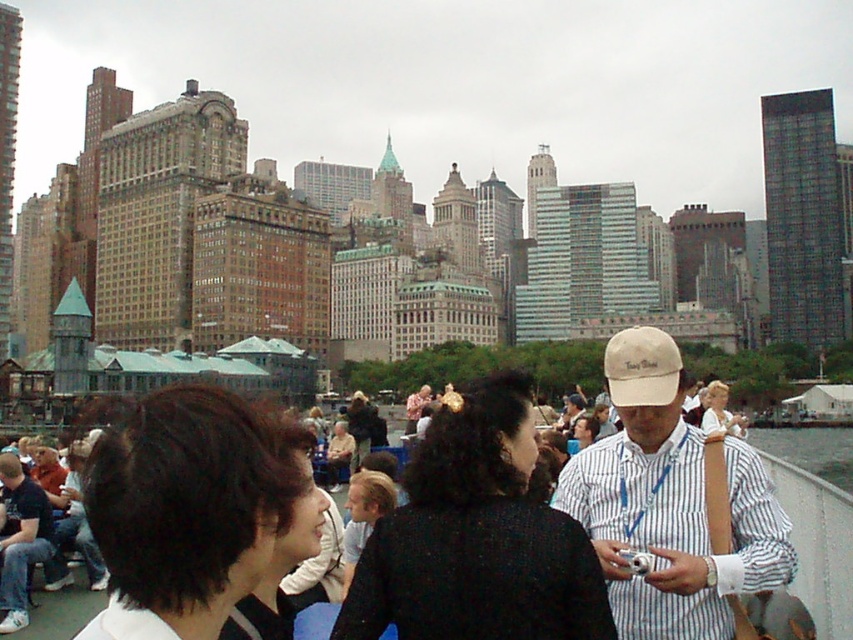
Which is in front, point (646, 372) or point (838, 429)?

Positioned in front is point (646, 372).

Between beige fabric baseball cap at center and clear glass water at lower right, which one appears on the right side from the viewer's perspective?

clear glass water at lower right

The width and height of the screenshot is (853, 640). In order to click on beige fabric baseball cap at center in this screenshot , I will do `click(641, 368)`.

The width and height of the screenshot is (853, 640). I want to click on beige fabric baseball cap at center-right, so click(x=670, y=502).

Describe the element at coordinates (670, 502) in the screenshot. I see `beige fabric baseball cap at center-right` at that location.

Find the location of a particular element. beige fabric baseball cap at center-right is located at coordinates (670, 502).

Does point (664, 524) come closer to viewer compared to point (817, 468)?

Yes, point (664, 524) is in front of point (817, 468).

Can you confirm if beige fabric baseball cap at center-right is positioned to the left of clear glass water at lower right?

Correct, you'll find beige fabric baseball cap at center-right to the left of clear glass water at lower right.

What do you see at coordinates (670, 502) in the screenshot? I see `beige fabric baseball cap at center-right` at bounding box center [670, 502].

Locate an element on the screen. The width and height of the screenshot is (853, 640). beige fabric baseball cap at center-right is located at coordinates (670, 502).